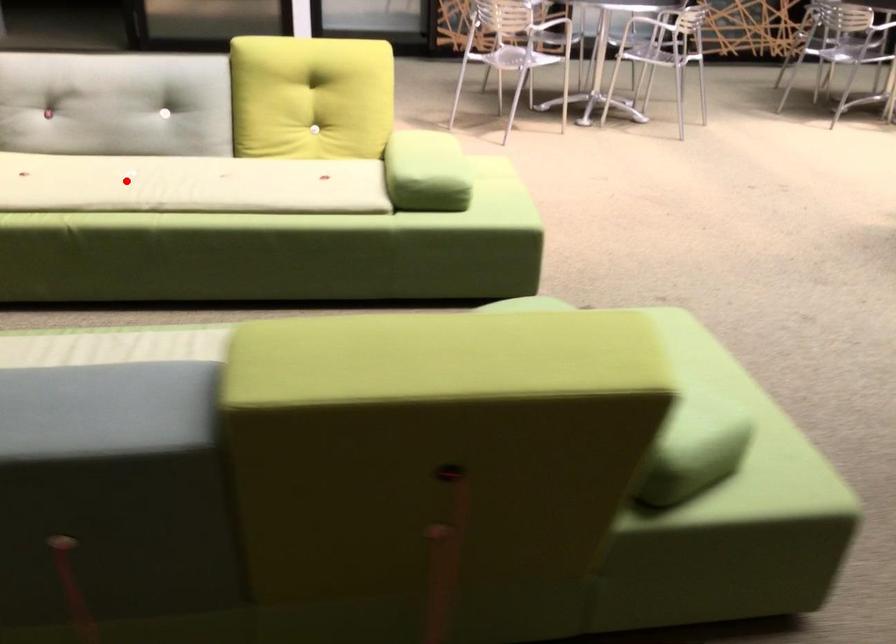
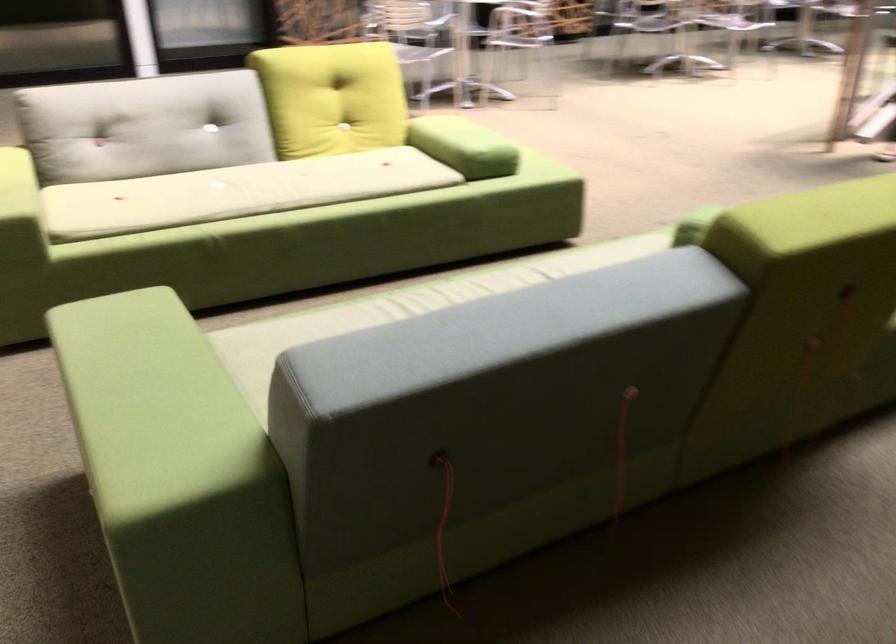
The point at the highlighted location is marked in the first image. Where is the corresponding point in the second image?

(236, 192)